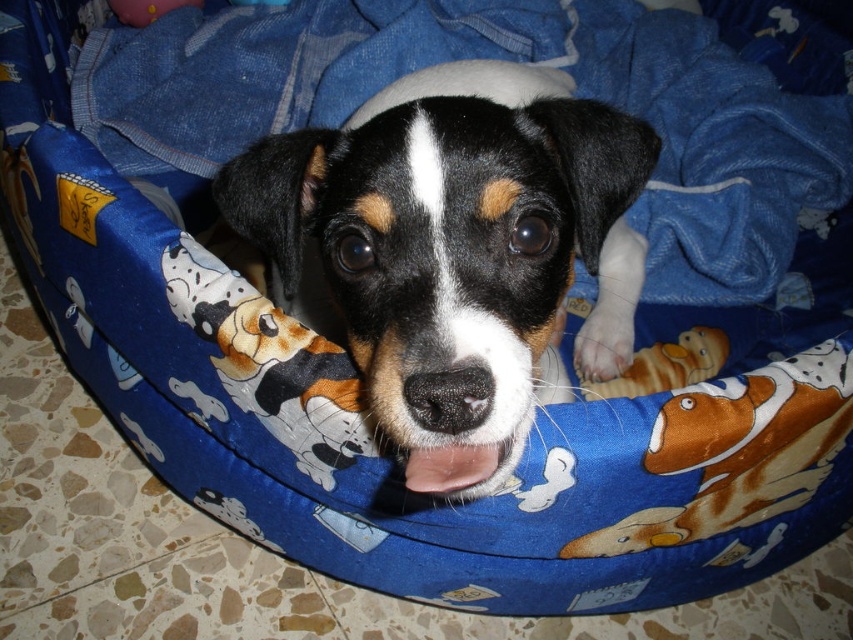
Question: Which object appears farthest from the camera in this image?

Choices:
 (A) blue fabric blanket at center
 (B) brown plush dog at center

Answer: (A)

Question: Can you confirm if black fur dog at center is thinner than blue fabric blanket at center?

Choices:
 (A) no
 (B) yes

Answer: (B)

Question: Among these objects, which one is nearest to the camera?

Choices:
 (A) blue fabric blanket at center
 (B) black fur dog at center
 (C) brown plush dog at center

Answer: (B)

Question: Is black fur dog at center further to camera compared to blue fabric blanket at center?

Choices:
 (A) yes
 (B) no

Answer: (B)

Question: Among these points, which one is farthest from the camera?

Choices:
 (A) (672, 349)
 (B) (416, 186)

Answer: (A)

Question: In this image, where is black fur dog at center located relative to blue fabric blanket at center?

Choices:
 (A) left
 (B) right

Answer: (B)